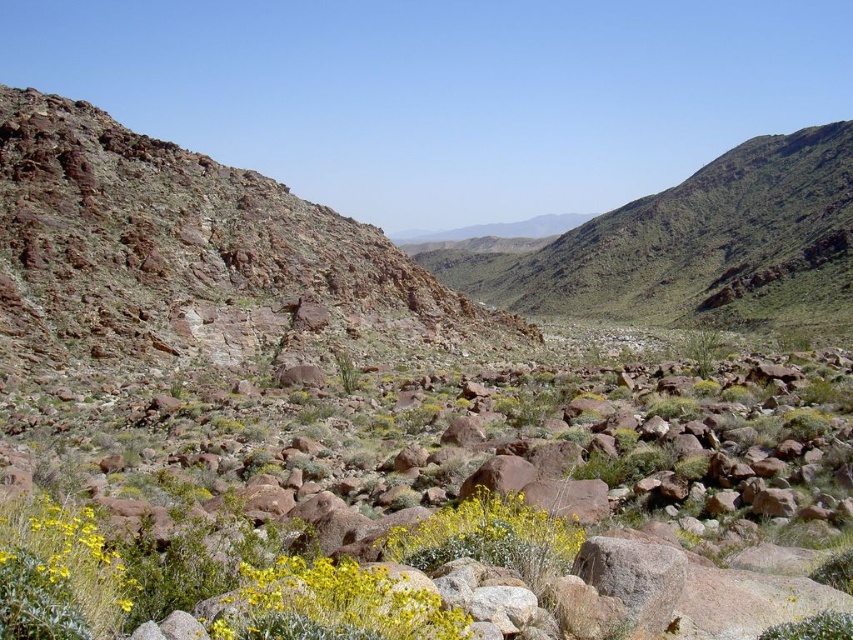
Question: Is yellow matte flower at lower center to the right of yellow matte flower at center from the viewer's perspective?

Choices:
 (A) yes
 (B) no

Answer: (B)

Question: Can you confirm if yellow matte flower at lower center is positioned above yellow matte flower at center?

Choices:
 (A) yes
 (B) no

Answer: (B)

Question: Which of the following is the closest to the observer?

Choices:
 (A) (251, 593)
 (B) (413, 536)

Answer: (A)

Question: Considering the relative positions of yellow matte flower at lower center and yellow matte flower at center in the image provided, where is yellow matte flower at lower center located with respect to yellow matte flower at center?

Choices:
 (A) right
 (B) left

Answer: (B)

Question: Which object appears farthest from the camera in this image?

Choices:
 (A) yellow matte flower at center
 (B) yellow matte flower at lower center

Answer: (A)